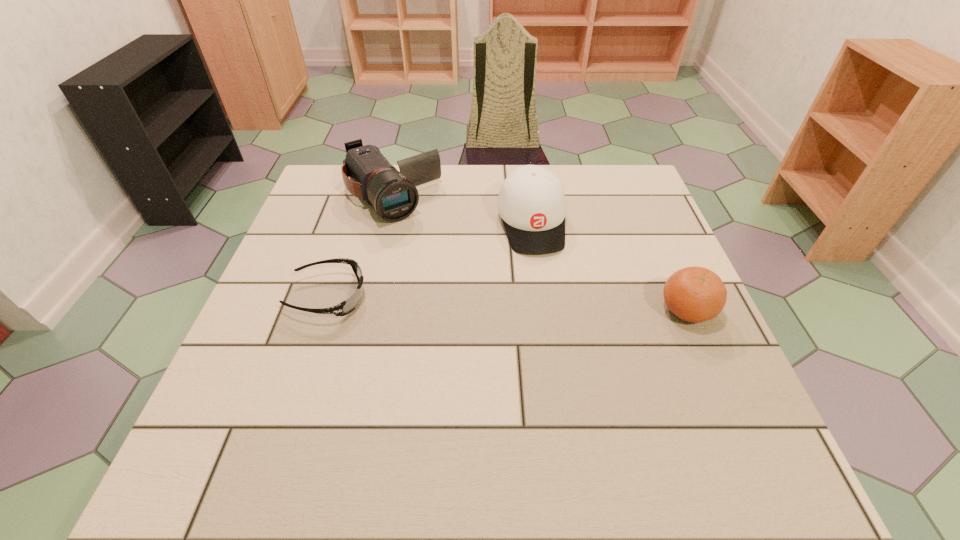
Identify the location of vacant space on the desktop that is between the sunglasses and the rightmost object and is positioned on the lens of the camcorder. Image resolution: width=960 pixels, height=540 pixels. (477, 302).

You are a GUI agent. You are given a task and a screenshot of the screen. Output one action in this format:
    pyautogui.click(x=<x>, y=<y>)
    Task: Click on the vacant space on the desktop that is between the shortest object and the clementine and is positioned on the front-facing side of the baseball cap
    The height and width of the screenshot is (540, 960).
    Given the screenshot: What is the action you would take?
    pyautogui.click(x=552, y=305)